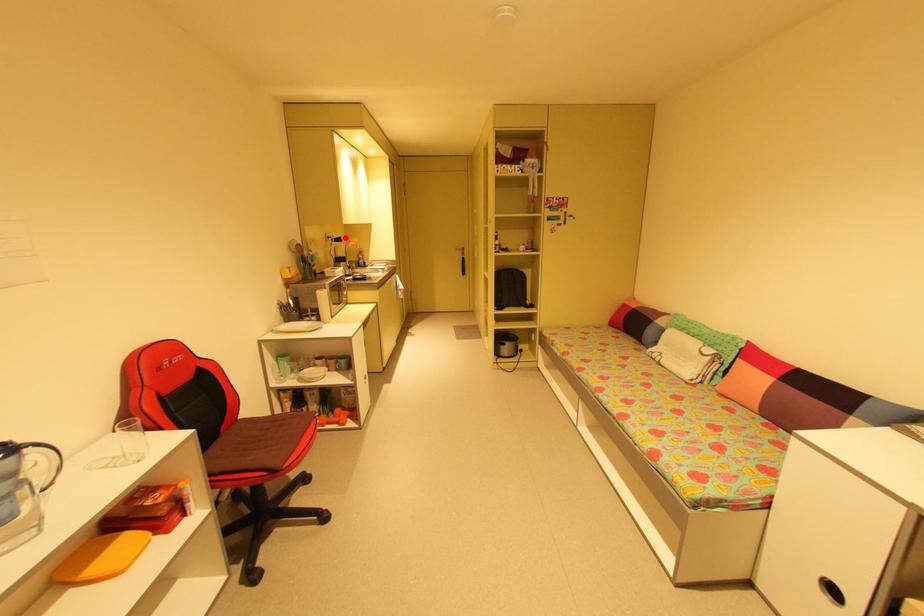
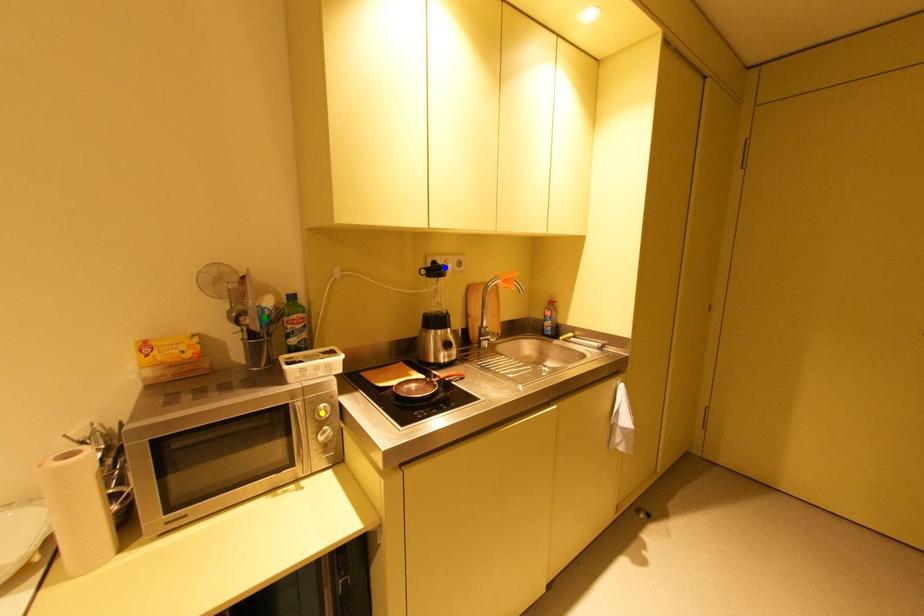
Question: I am providing you with two images of the same scene from different viewpoints. A red point is marked on the first image. You are given multiple points on the second image. Which point in image 2 represents the same 3d spot as the red point in image 1?

Choices:
 (A) green point
 (B) yellow point
 (C) blue point

Answer: (C)